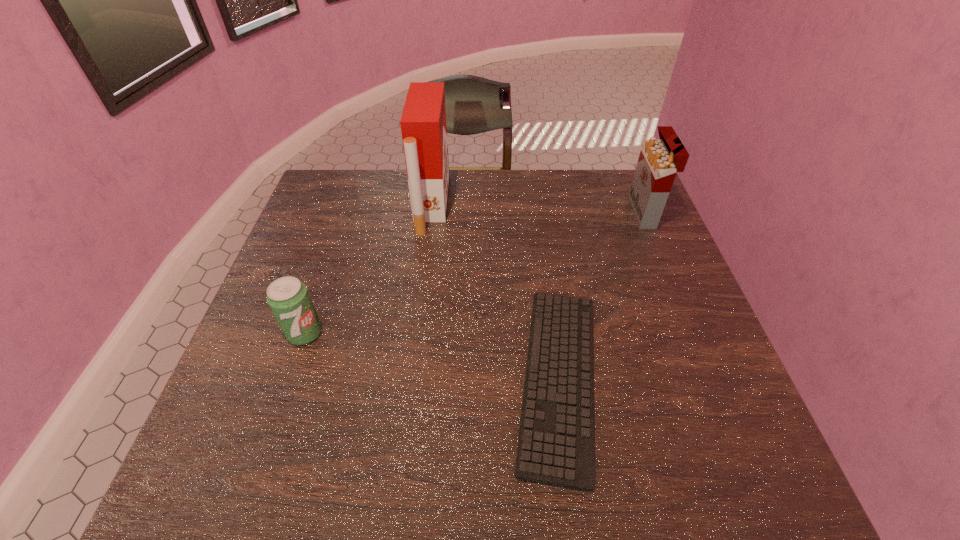
This screenshot has height=540, width=960. Identify the location of free space at the left edge of the desktop. (213, 417).

The height and width of the screenshot is (540, 960). Identify the location of free space at the right edge. (669, 411).

Where is `free region at the far left corner of the desktop`? free region at the far left corner of the desktop is located at coordinates (350, 195).

In the image, there is a desktop. Identify the location of vacant area at the near left corner. Image resolution: width=960 pixels, height=540 pixels. (252, 483).

You are a GUI agent. You are given a task and a screenshot of the screen. Output one action in this format:
    pyautogui.click(x=<x>, y=<y>)
    Task: Click on the free space at the far right corner of the desktop
    This screenshot has height=540, width=960.
    Given the screenshot: What is the action you would take?
    pyautogui.click(x=595, y=193)

Identify the location of free point between the computer keyboard and the leftmost object. (432, 356).

Where is `free point between the right cigarette case and the second object from left to right`? free point between the right cigarette case and the second object from left to right is located at coordinates (538, 208).

This screenshot has height=540, width=960. I want to click on vacant area that lies between the shorter cigarette case and the third object from left to right, so click(x=601, y=296).

Where is `vacant region between the third tallest object and the rightmost object`? This screenshot has width=960, height=540. vacant region between the third tallest object and the rightmost object is located at coordinates (474, 273).

Image resolution: width=960 pixels, height=540 pixels. I want to click on free spot between the rightmost object and the third object from right to left, so click(x=538, y=208).